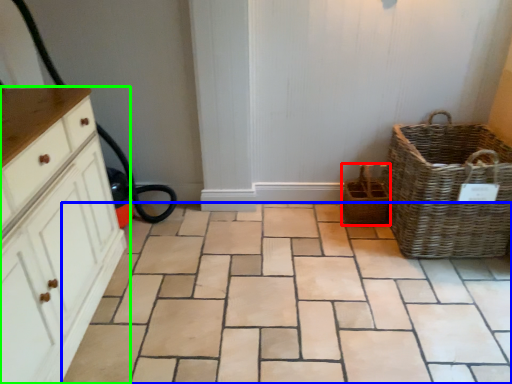
Question: Estimate the real-world distances between objects in this image. Which object is farther from basket (highlighted by a red box), ceramic tile (highlighted by a blue box) or chest of drawers (highlighted by a green box)?

Choices:
 (A) ceramic tile
 (B) chest of drawers

Answer: (B)